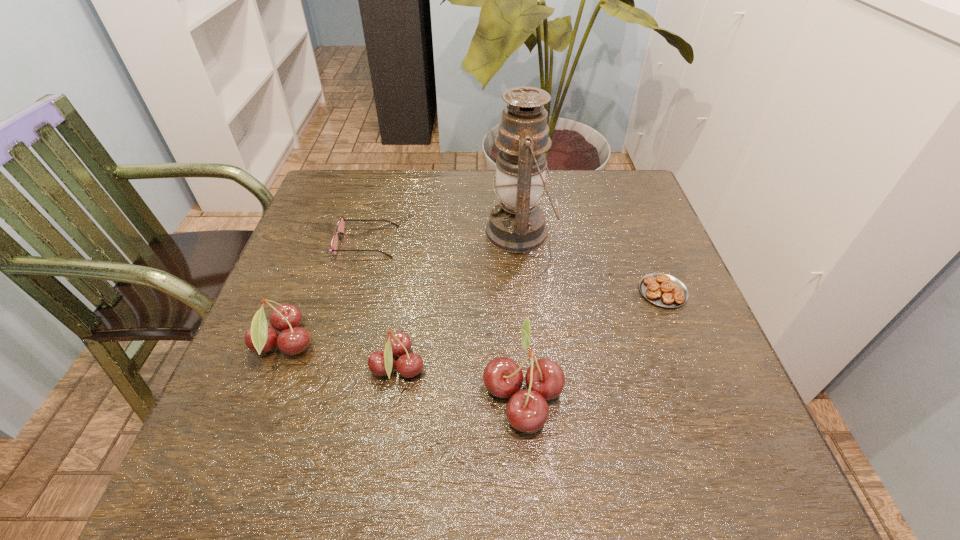
Please point a vacant point for placing a cherry on the right. Please provide its 2D coordinates. Your answer should be formatted as a tuple, i.e. [(x, y)], where the tuple contains the x and y coordinates of a point satisfying the conditions above.

[(660, 422)]